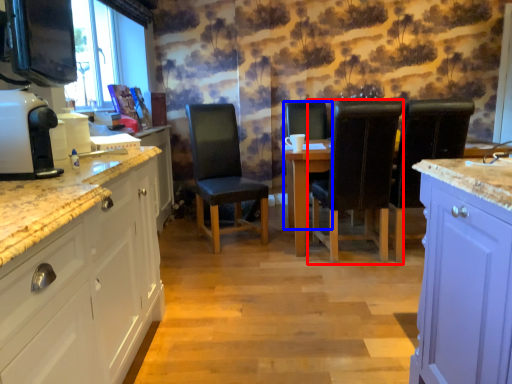
Question: Which object is closer to the camera taking this photo, chair (highlighted by a red box) or chair (highlighted by a blue box)?

Choices:
 (A) chair
 (B) chair

Answer: (A)